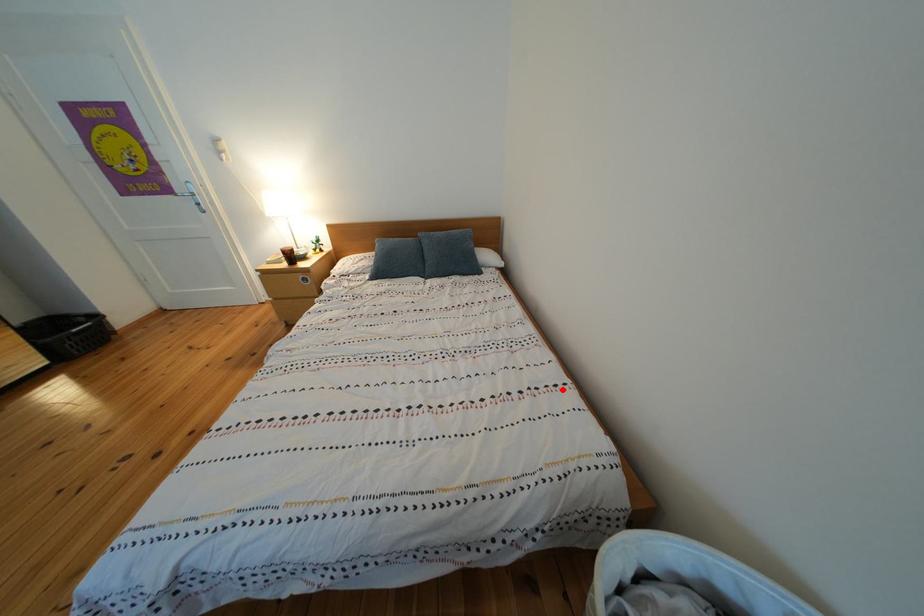
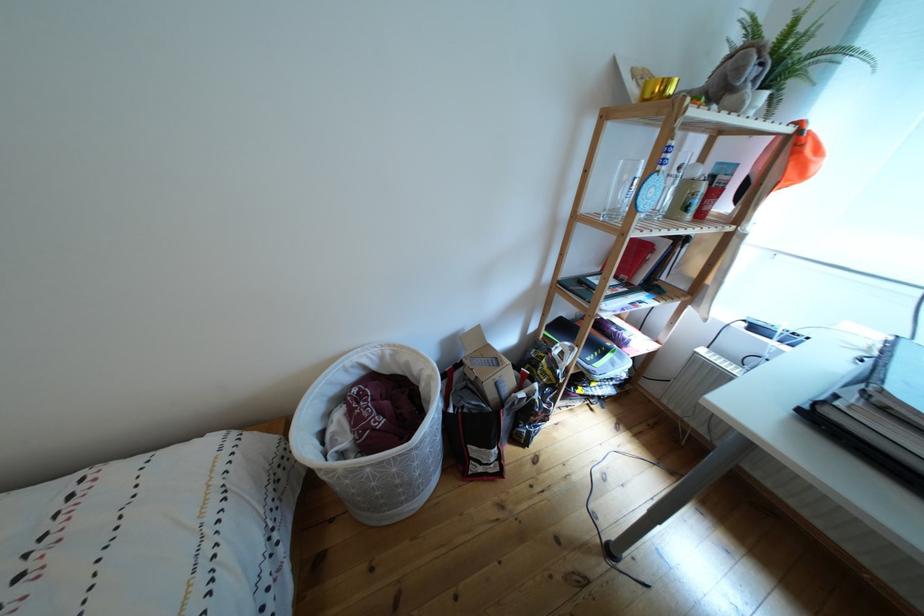
In the second image, find the point that corresponds to the highlighted location in the first image.

(70, 512)